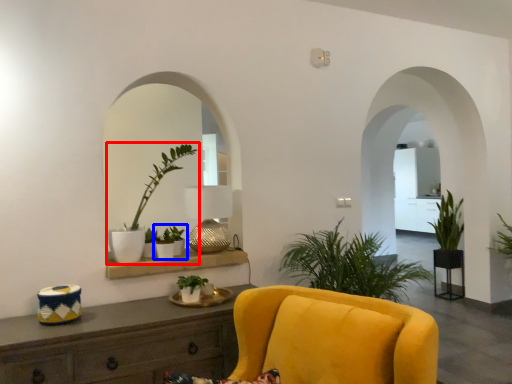
Question: Which point is closer to the camera, houseplant (highlighted by a red box) or houseplant (highlighted by a blue box)?

Choices:
 (A) houseplant
 (B) houseplant

Answer: (A)